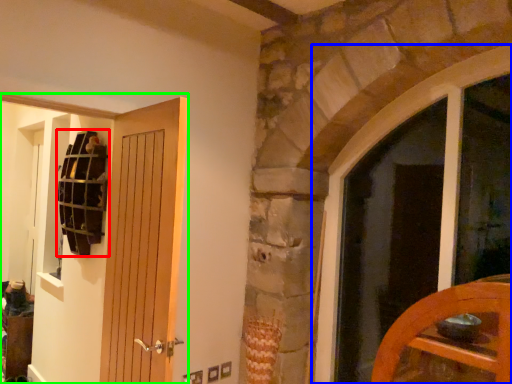
Question: Estimate the real-world distances between objects in this image. Which object is closer to shelf (highlighted by a red box), window (highlighted by a blue box) or door (highlighted by a green box)?

Choices:
 (A) window
 (B) door

Answer: (B)